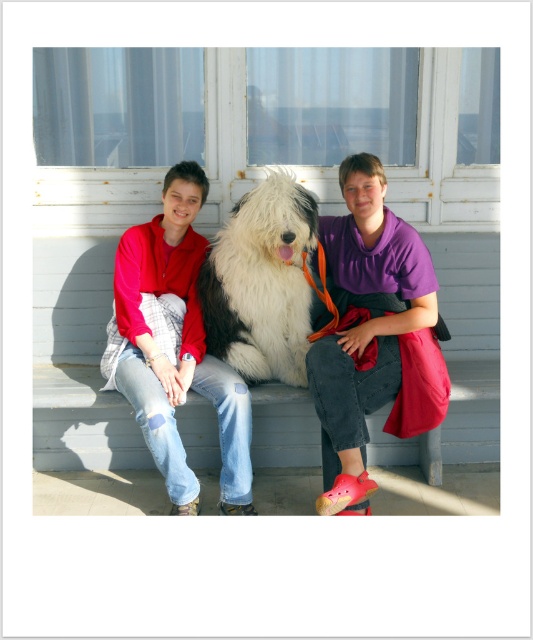
You are a photographer trying to capture a group photo of the purple cotton shirt at center and the fluffy white dog at center. Since you want to ensure both subjects are fully visible in the frame, which subject should you position closer to the camera to avoid cropping?

The purple cotton shirt at center is wider than the fluffy white dog at center. To ensure both are fully visible, position the purple cotton shirt at center closer to the camera since its greater width requires more space in the frame.

You are standing on the porch and want to pet the fluffy fur dog at center. To reach it, you need to walk around the matte red jacket at left. Is the dog in front of or behind the jacket?

The fluffy fur dog at center is in front of the matte red jacket at left, so the dog is already in front of the jacket. You don not need to walk around the jacket to reach it.

You are a photographer trying to capture a group photo of the two people and the dog. The camera you are using has a maximum width capacity of 1.2 meters. Given the sizes of the fluffy fur dog at center and the purple cotton shirt at center, can you fit all three subjects within the camera frame?

The fluffy fur dog at center is wider than the purple cotton shirt at center. Since the dog is wider, but the exact width isn not specified, it is uncertain if all three subjects can fit within the 1.2 meter frame. More information about their combined width is needed.